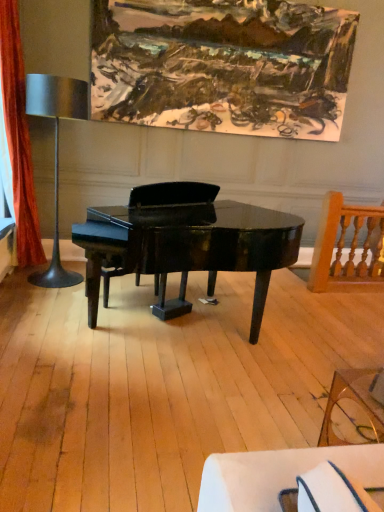
Question: From the image's perspective, is orange velvet curtain at left above or below transparent glass coffee table at lower right?

Choices:
 (A) below
 (B) above

Answer: (B)

Question: Is orange velvet curtain at left bigger or smaller than transparent glass coffee table at lower right?

Choices:
 (A) big
 (B) small

Answer: (A)

Question: Which of these objects is positioned farthest from the glossy black piano at center?

Choices:
 (A) metallic silver table lamp at left
 (B) wooden spindle chair at right
 (C) transparent glass coffee table at lower right
 (D) orange velvet curtain at left
 (E) oil paint canvas at upper center

Answer: (E)

Question: Which object is the closest to the transparent glass coffee table at lower right?

Choices:
 (A) glossy black piano at center
 (B) metallic silver table lamp at left
 (C) orange velvet curtain at left
 (D) oil paint canvas at upper center
 (E) wooden spindle chair at right

Answer: (A)